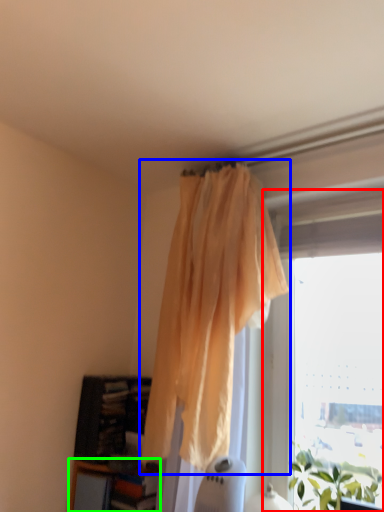
Question: Estimate the real-world distances between objects in this image. Which object is closer to window (highlighted by a red box), curtain (highlighted by a blue box) or shelf (highlighted by a green box)?

Choices:
 (A) curtain
 (B) shelf

Answer: (A)